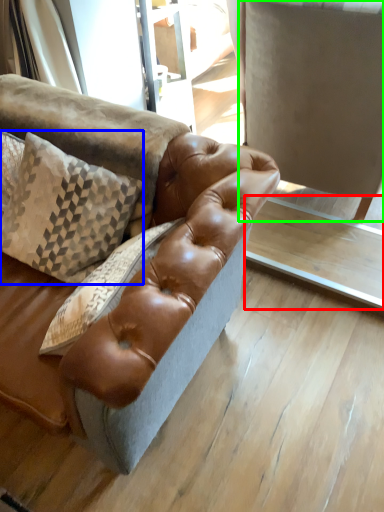
Question: Which is farther away from table (highlighted by a red box)? pillow (highlighted by a blue box) or swivel chair (highlighted by a green box)?

Choices:
 (A) pillow
 (B) swivel chair

Answer: (A)